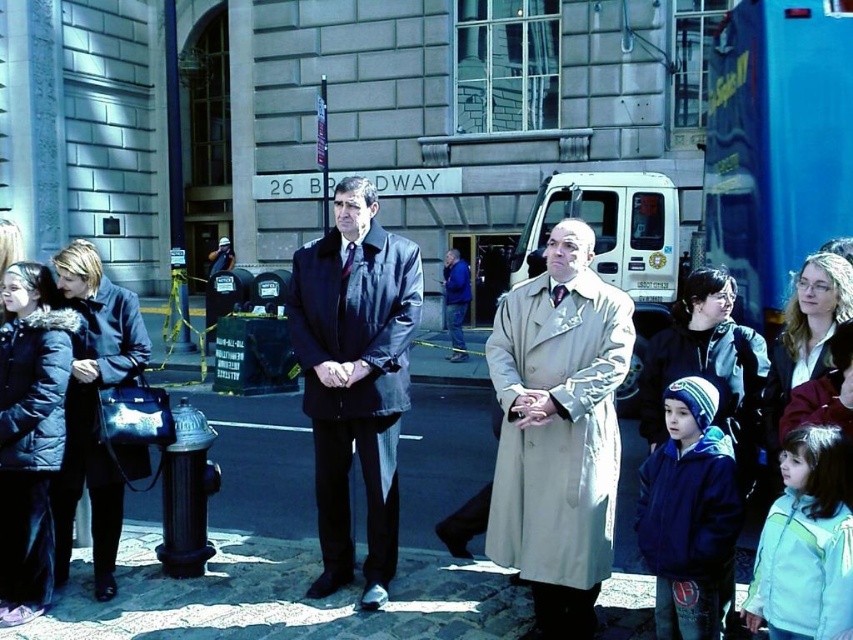
Which is behind, point (561, 444) or point (349, 388)?

The point (349, 388) is behind.

Which is behind, point (566, 524) or point (316, 586)?

Point (316, 586)

Locate an element on the screen. beige leather trench coat at center is located at coordinates (558, 432).

Does dark brown leather jacket at center appear on the right side of velvet black coat at left?

Yes, dark brown leather jacket at center is to the right of velvet black coat at left.

Who is more forward, (331, 385) or (114, 483)?

Point (331, 385) is in front.

Who is more forward, (312, 369) or (112, 545)?

Point (312, 369)

Locate an element on the screen. dark brown leather jacket at center is located at coordinates 355,378.

Does beige leather trench coat at center have a larger size compared to velvet black coat at left?

Yes, beige leather trench coat at center is bigger than velvet black coat at left.

Is point (567, 305) positioned behind point (65, 252)?

No, (567, 305) is in front of (65, 252).

Is point (625, 348) positioned in front of point (80, 384)?

Yes, it is in front of point (80, 384).

Find the location of a particular element. The width and height of the screenshot is (853, 640). beige leather trench coat at center is located at coordinates (558, 432).